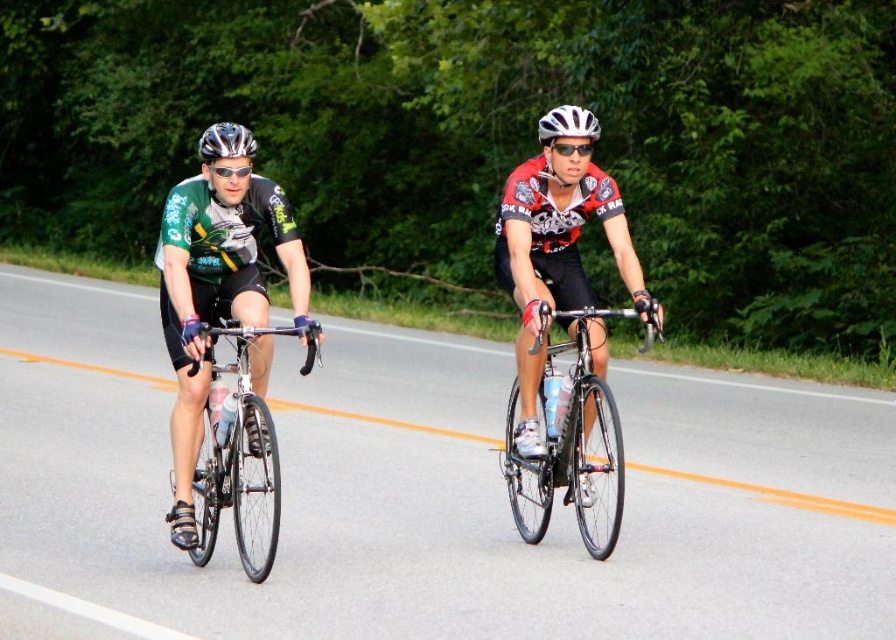
Question: Among these objects, which one is nearest to the camera?

Choices:
 (A) matte black helmet at left
 (B) shiny silver bicycle at left

Answer: (B)

Question: Is matte black bicycle at center further to camera compared to shiny silver helmet at upper center?

Choices:
 (A) no
 (B) yes

Answer: (A)

Question: Which object is the farthest from the shiny silver helmet at upper center?

Choices:
 (A) white matte helmet at center
 (B) shiny black frame at center
 (C) white matte bicycle helmet at center

Answer: (C)

Question: Can you confirm if matte black cycling jersey at left is wider than white matte bicycle helmet at center?

Choices:
 (A) yes
 (B) no

Answer: (B)

Question: Can you confirm if matte black bicycle at center is positioned below matte black helmet at left?

Choices:
 (A) no
 (B) yes

Answer: (B)

Question: Which object is positioned farthest from the white matte helmet at center?

Choices:
 (A) matte black helmet at left
 (B) shiny black frame at center
 (C) matte black bicycle at center
 (D) white matte bicycle helmet at center

Answer: (A)